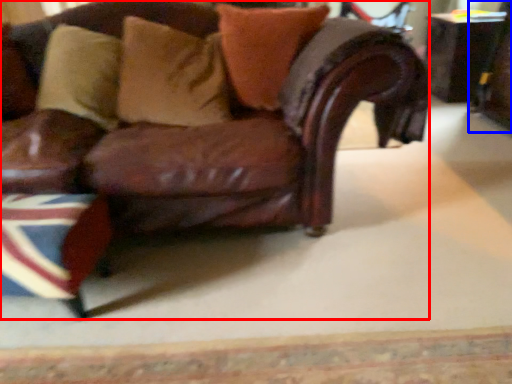
Question: Which of the following is the farthest to the observer, chair (highlighted by a red box) or swivel chair (highlighted by a blue box)?

Choices:
 (A) chair
 (B) swivel chair

Answer: (B)